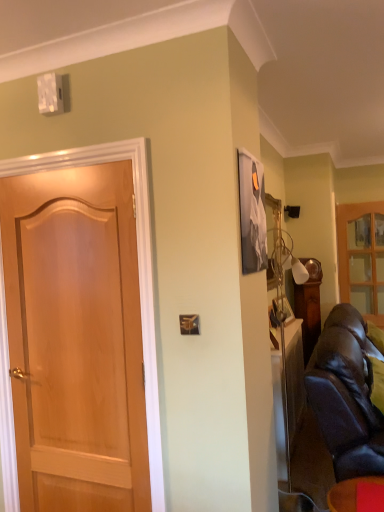
Question: Is leather couch at right positioned with its back to matte black leather couch at lower right?

Choices:
 (A) yes
 (B) no

Answer: (B)

Question: Is the position of leather couch at right less distant than that of matte black leather couch at lower right?

Choices:
 (A) no
 (B) yes

Answer: (A)

Question: Is leather couch at right not close to matte black leather couch at lower right?

Choices:
 (A) yes
 (B) no

Answer: (B)

Question: From the image's perspective, would you say leather couch at right is shown under matte black leather couch at lower right?

Choices:
 (A) no
 (B) yes

Answer: (A)

Question: Can you confirm if leather couch at right is shorter than matte black leather couch at lower right?

Choices:
 (A) yes
 (B) no

Answer: (B)

Question: Visually, is leather couch at right positioned to the left or to the right of matte black leather couch at lower right?

Choices:
 (A) right
 (B) left

Answer: (A)

Question: From a real-world perspective, is leather couch at right positioned above or below matte black leather couch at lower right?

Choices:
 (A) above
 (B) below

Answer: (A)

Question: From the image's perspective, is leather couch at right located above or below matte black leather couch at lower right?

Choices:
 (A) below
 (B) above

Answer: (B)

Question: Is leather couch at right taller or shorter than matte black leather couch at lower right?

Choices:
 (A) short
 (B) tall

Answer: (B)

Question: Looking at their shapes, would you say light brown wood door at left is wider or thinner than leather couch at right?

Choices:
 (A) thin
 (B) wide

Answer: (A)

Question: From the image's perspective, relative to leather couch at right, is light brown wood door at left above or below?

Choices:
 (A) above
 (B) below

Answer: (A)

Question: Looking at the image, does light brown wood door at left seem bigger or smaller compared to leather couch at right?

Choices:
 (A) big
 (B) small

Answer: (B)

Question: In terms of height, does light brown wood door at left look taller or shorter compared to leather couch at right?

Choices:
 (A) short
 (B) tall

Answer: (B)

Question: Looking at their shapes, would you say light brown wood door at left is wider or thinner than wooden glass cabinet at right?

Choices:
 (A) wide
 (B) thin

Answer: (A)

Question: Is light brown wood door at left inside the boundaries of wooden glass cabinet at right, or outside?

Choices:
 (A) inside
 (B) outside

Answer: (B)